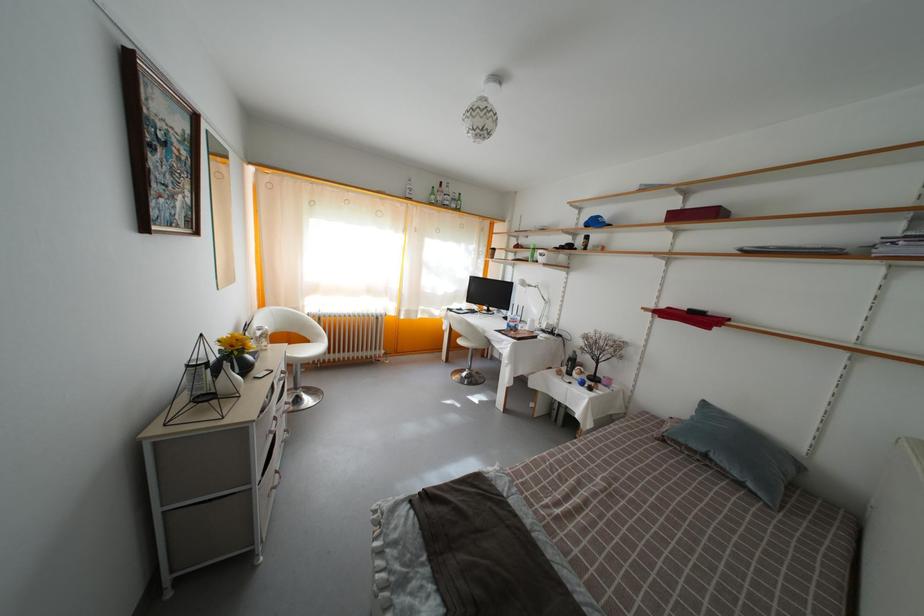
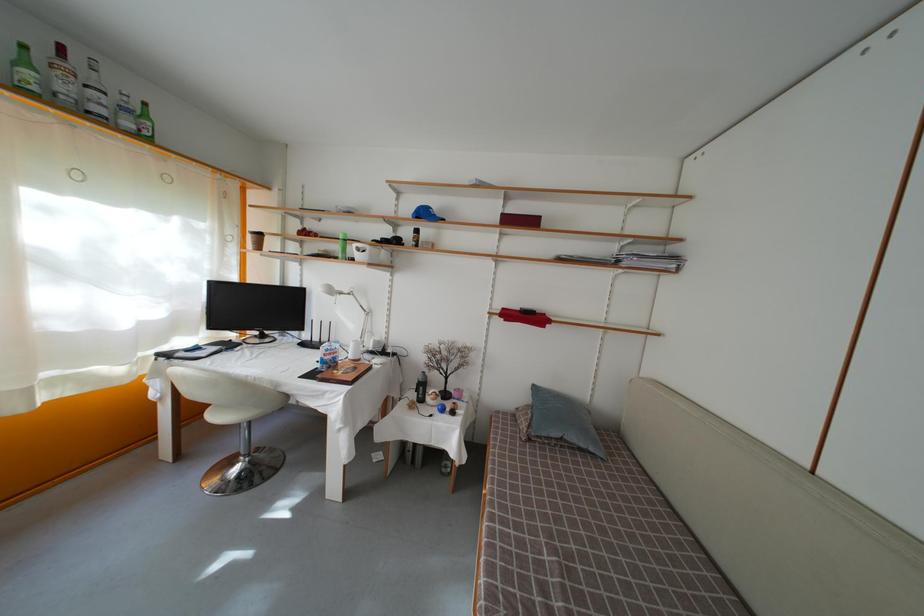
Question: I am providing you with two images of the same scene from different viewpoints. After the viewpoint changes to image2, which objects are now occluded?

Choices:
 (A) black water bottle
 (B) chair sitting surface
 (C) white liquor bottle
 (D) none of these

Answer: (D)